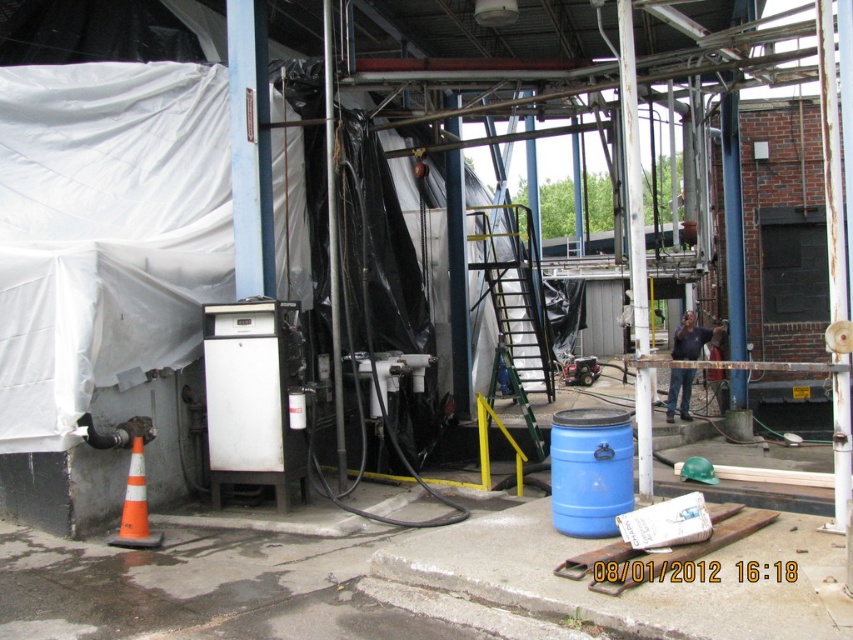
You are a worker in this industrial area and need to place a tool on the ground. You have a choice between putting it on the blue matte barrel at lower right or the orange plastic traffic cone at lower left. Which surface is higher and more stable for placing the tool?

The blue matte barrel at lower right is above the orange plastic traffic cone at lower left, making it higher and more stable for placing the tool.

You are a worker in this industrial area and need to place a new cylindrical object that is 1 meter in diameter. You have two options for placement spots next to the blue matte barrel at lower right and the orange plastic traffic cone at lower left. Which spot would allow the new object to fit without overlapping either existing item?

The blue matte barrel at lower right might be wider than the orange plastic traffic cone at lower left. If the barrel is wider, placing the new object next to it would require more space, so the traffic cone side might be better if the barrel is indeed wider. However, since the barrel might be wider, it depends on the exact width. Without precise measurements, it is uncertain.